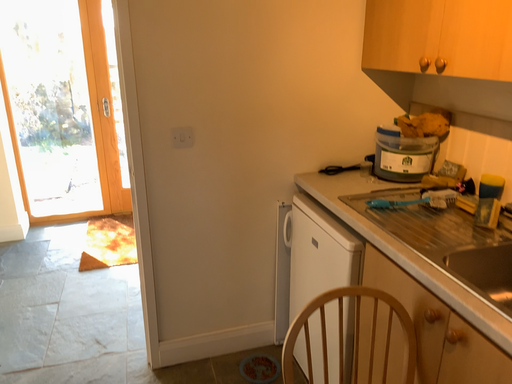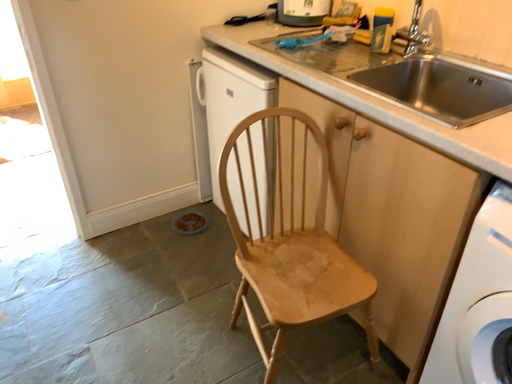
Question: Which way did the camera rotate in the video?

Choices:
 (A) rotated right
 (B) rotated left

Answer: (A)